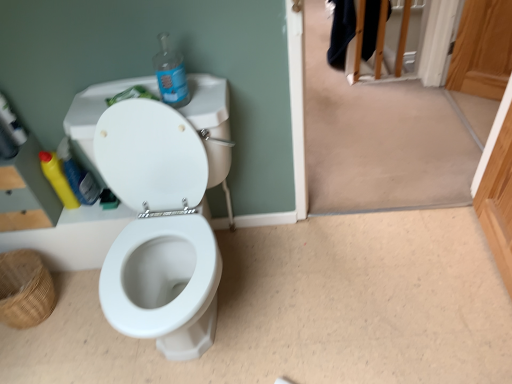
The width and height of the screenshot is (512, 384). Find the location of `vacant area that is in front of brown woven basket at lower left`. vacant area that is in front of brown woven basket at lower left is located at coordinates (36, 354).